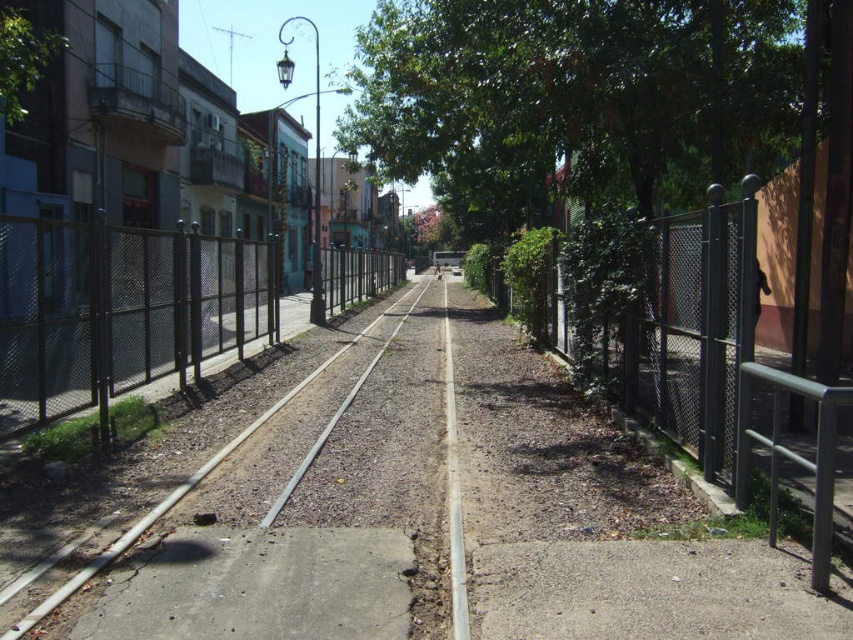
Based on the photo, you are standing at the point marked by coordinates point (119, 310). What object are you standing on?

You are standing on the black chain link fence at left.

You are a delivery person with a 2.5 meter wide cart. You need to pass through the narrowest part of the street between the two fences. The fences are located at point (190, 316). Can your cart fit through the space between them?

The distance between the fences at point (190, 316) is 10.31 meters, which is wider than the cart. The cart can pass through safely.